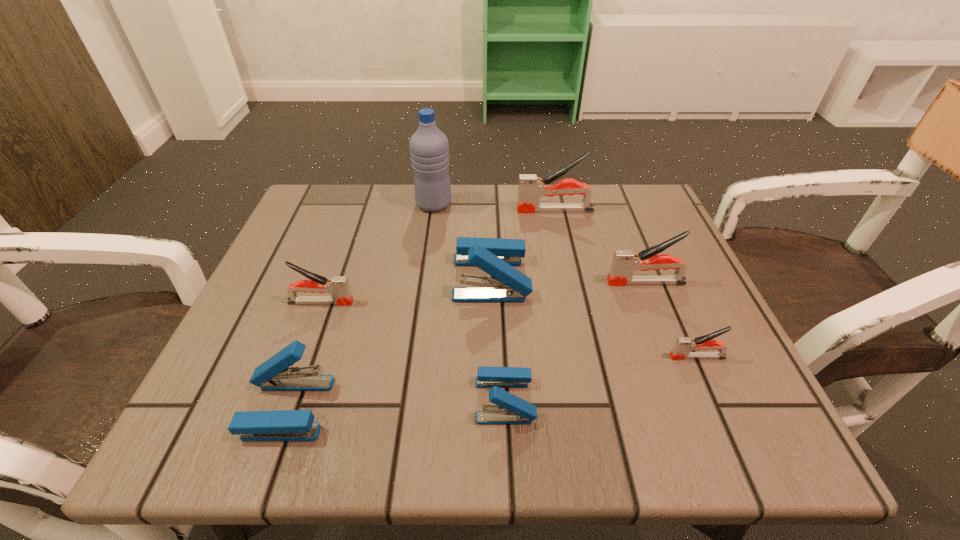
In the image, there is a desktop. Identify the location of free space at the far edge. The height and width of the screenshot is (540, 960). (547, 241).

In the image, there is a desktop. Where is `vacant space at the near edge`? The image size is (960, 540). vacant space at the near edge is located at coordinates (438, 403).

Identify the location of free space at the left edge. This screenshot has height=540, width=960. (233, 332).

In the image, there is a desktop. Identify the location of vacant space at the right edge. The width and height of the screenshot is (960, 540). (661, 341).

I want to click on vacant region at the far left corner of the desktop, so click(x=346, y=240).

The image size is (960, 540). In the image, there is a desktop. Find the location of `blank space at the far right corner`. blank space at the far right corner is located at coordinates (643, 235).

Where is `vacant area that lies between the second biggest blue stapler and the farthest gray stapler`? This screenshot has width=960, height=540. vacant area that lies between the second biggest blue stapler and the farthest gray stapler is located at coordinates (421, 309).

The width and height of the screenshot is (960, 540). Find the location of `empty location between the seventh shortest object and the second biggest blue stapler`. empty location between the seventh shortest object and the second biggest blue stapler is located at coordinates (421, 309).

The image size is (960, 540). I want to click on free space between the smallest blue stapler and the third nearest gray stapler, so click(575, 341).

Find the location of `free spot between the leftmost gray stapler and the water bottle`. free spot between the leftmost gray stapler and the water bottle is located at coordinates (377, 253).